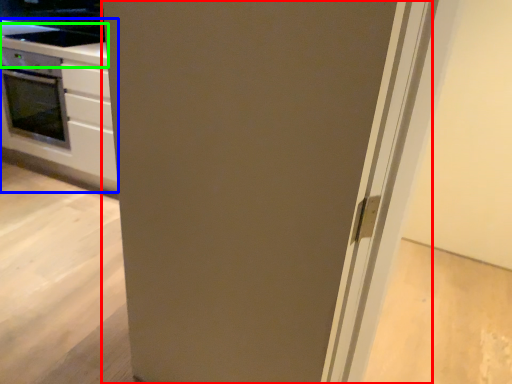
Question: Which object is positioned farthest from door (highlighted by a red box)? Select from cabinetry (highlighted by a blue box) and counter top (highlighted by a green box).

Choices:
 (A) cabinetry
 (B) counter top

Answer: (B)